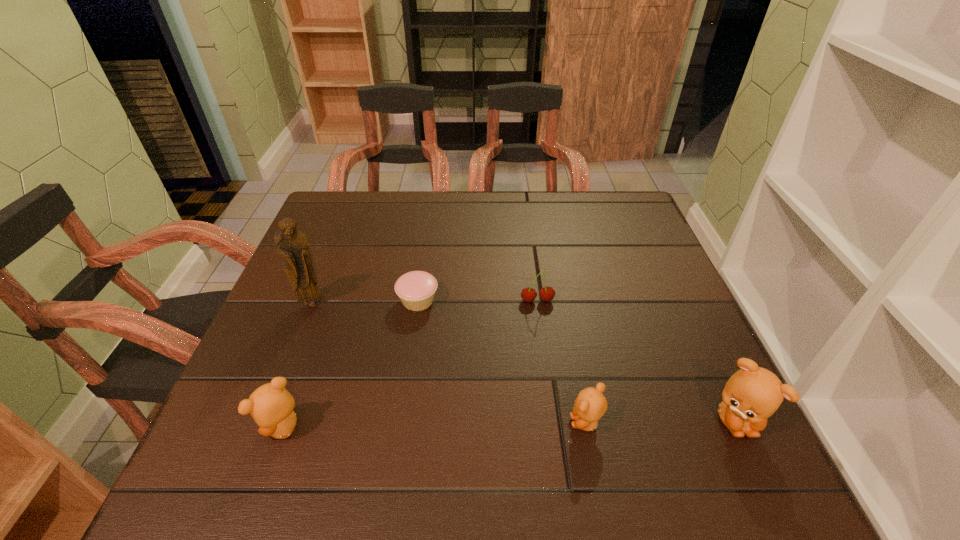
This screenshot has width=960, height=540. In order to click on vacant area situated on the face of the second teddy bear from left to right in this screenshot , I will do `click(399, 423)`.

Where is `vacant region located 0.110m on the face of the second teddy bear from left to right`? vacant region located 0.110m on the face of the second teddy bear from left to right is located at coordinates (509, 423).

What are the coordinates of `free space located on the surface of the cherry` in the screenshot? It's located at 548,383.

Where is `free point located on the front-facing side of the figurine`? free point located on the front-facing side of the figurine is located at coordinates (293, 354).

Where is `free region located 0.180m on the left of the shortest object`? Image resolution: width=960 pixels, height=540 pixels. free region located 0.180m on the left of the shortest object is located at coordinates [321, 300].

Where is `teddy bear that is at the left edge`? The height and width of the screenshot is (540, 960). teddy bear that is at the left edge is located at coordinates (271, 406).

At what (x,y) coordinates should I click in order to perform the action: click on figurine at the left edge. Please return your answer as a coordinate pair (x, y). The image size is (960, 540). Looking at the image, I should click on (291, 243).

Locate an element on the screen. The height and width of the screenshot is (540, 960). object situated at the right edge is located at coordinates [x=752, y=394].

Find the location of a particular element. object at the near left corner is located at coordinates (271, 406).

Image resolution: width=960 pixels, height=540 pixels. In order to click on object positioned at the near right corner in this screenshot , I will do `click(752, 394)`.